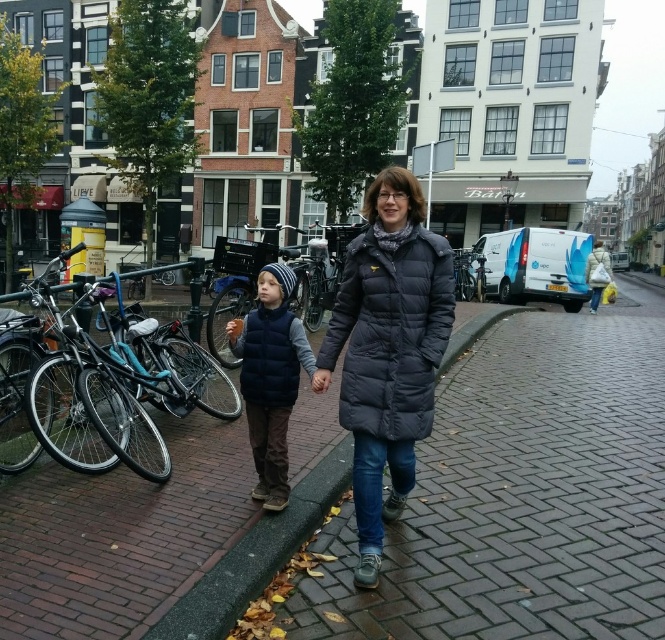
Question: Among these points, which one is farthest from the camera?

Choices:
 (A) (303, 502)
 (B) (342, 380)

Answer: (A)

Question: Does shiny blue bicycle at left have a greater width compared to navy puffer coat at center?

Choices:
 (A) yes
 (B) no

Answer: (A)

Question: Is brick at center behind velvet navy vest at center?

Choices:
 (A) yes
 (B) no

Answer: (B)

Question: Which point is closer to the camera taking this photo?

Choices:
 (A) (154, 346)
 (B) (378, 408)
 (C) (267, 284)
 (D) (311, 497)

Answer: (B)

Question: Does navy puffer coat at center lie in front of velvet navy vest at center?

Choices:
 (A) yes
 (B) no

Answer: (A)

Question: Which of these objects is positioned closest to the shiny blue bicycle at left?

Choices:
 (A) velvet navy vest at center
 (B) navy puffer coat at center
 (C) brick at center

Answer: (A)